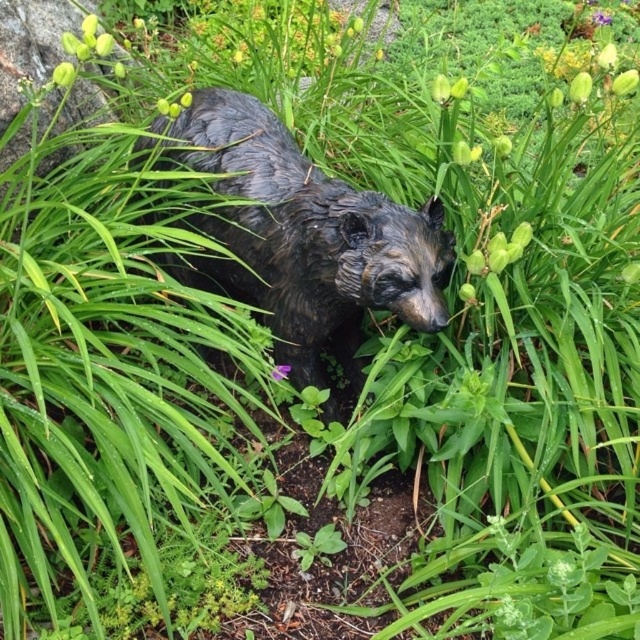
You are a gardener trying to locate the bronze statue of bear at center in the garden. You see the purple matte flower at center. Which direction should you move from the flower to find the statue?

The bronze statue of bear at center is to the right of the purple matte flower at center, so you should move to the right from the flower to find the statue.

You are standing in the garden looking at the black bear statue. There are two points marked on the statue. One is at point (385,195) and the other at point (276,369). Which point is closer to you?

Point (276,369) is closer to you because it is less further to the camera than point (385,195).

You are a gardener trying to place a new decorative pot between the bronze statue of bear at center and the purple matte flower at center. Based on their sizes, can you estimate if there will be enough space for the pot?

The bronze statue of bear at center might be wider than the purple matte flower at center, so there may not be enough space for the pot between them. It is recommended to measure the distance first before placing the pot.